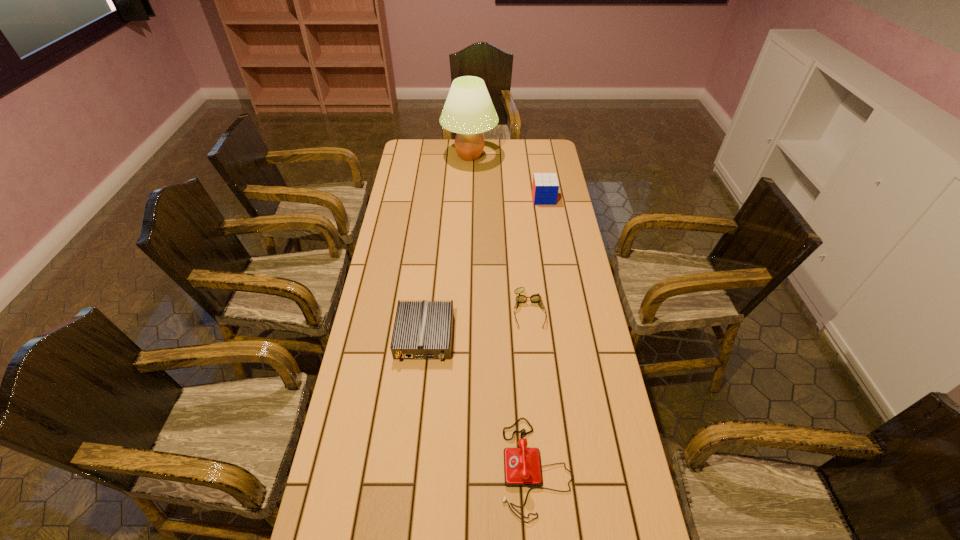
At what (x,y) coordinates should I click in order to perform the action: click on the farthest object. Please return your answer as a coordinate pair (x, y). This screenshot has height=540, width=960. Looking at the image, I should click on (468, 111).

I want to click on lampshade, so click(x=468, y=111).

Identify the location of cube. (545, 187).

Where is `the fourth nearest object`? The height and width of the screenshot is (540, 960). the fourth nearest object is located at coordinates (545, 187).

This screenshot has width=960, height=540. I want to click on telephone, so click(x=522, y=467).

What are the coordinates of `router` in the screenshot? It's located at (422, 330).

You are a GUI agent. You are given a task and a screenshot of the screen. Output one action in this format:
    pyautogui.click(x=<x>, y=<y>)
    Task: Click on the shortest object
    
    Given the screenshot: What is the action you would take?
    pyautogui.click(x=535, y=298)

I want to click on vacant region located on the shade of the tallest object, so click(x=516, y=156).

Where is `free space located 0.140m on the front of the fourth shortest object`? The width and height of the screenshot is (960, 540). free space located 0.140m on the front of the fourth shortest object is located at coordinates (548, 226).

Locate an element on the screen. The width and height of the screenshot is (960, 540). free region located 0.380m on the dial of the nearest object is located at coordinates (350, 467).